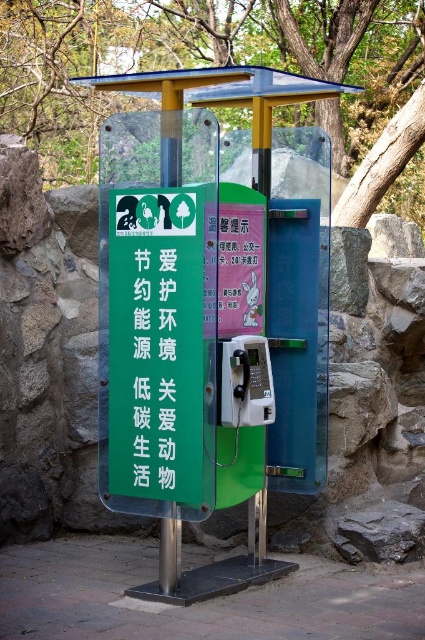
Question: Does green plastic tree at upper center have a smaller size compared to green matte sign at center?

Choices:
 (A) no
 (B) yes

Answer: (A)

Question: Can you confirm if green metallic sign at center is positioned to the left of green matte sign at center?

Choices:
 (A) no
 (B) yes

Answer: (A)

Question: Which point is closer to the camera taking this photo?

Choices:
 (A) (135, 275)
 (B) (187, 275)
 (C) (76, 156)

Answer: (B)

Question: Does green metallic bus stop at center have a greater width compared to green plastic tree at upper center?

Choices:
 (A) no
 (B) yes

Answer: (A)

Question: Which point appears farthest from the camera in this image?

Choices:
 (A) (170, 426)
 (B) (226, 387)
 (C) (81, 64)
 (D) (172, 385)

Answer: (C)

Question: Which point is closer to the camera taking this photo?

Choices:
 (A) (231, 378)
 (B) (175, 307)

Answer: (B)